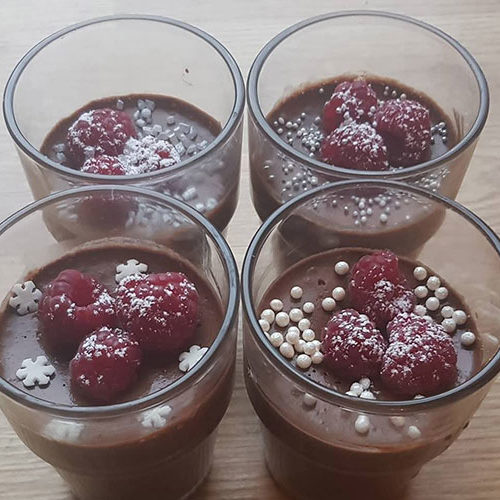
What are the coordinates of `glass` in the screenshot? It's located at (448, 260), (404, 52), (148, 63), (196, 230).